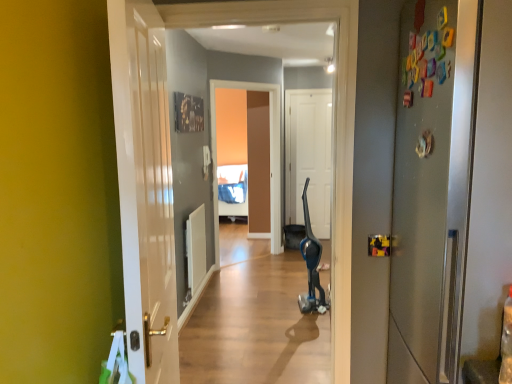
Question: In terms of width, does white glossy door at left, the 2th door viewed from the front, look wider or thinner when compared to satin silver refrigerator at right, positioned as the third door in left-to-right order?

Choices:
 (A) thin
 (B) wide

Answer: (A)

Question: From the image's perspective, is white glossy door at left, the 2th door viewed from the front, positioned above or below satin silver refrigerator at right, which is counted as the 3th door, starting from the back?

Choices:
 (A) above
 (B) below

Answer: (B)

Question: Which object is positioned farthest from the white glossy door at left, positioned as the 3th door in right-to-left order?

Choices:
 (A) matte brown screen door at center
 (B) blue metallic vacuum cleaner at center
 (C) black plastic vacuum cleaner at center
 (D) satin silver refrigerator at right, which is counted as the 3th door, starting from the back
 (E) white matte door at center, positioned as the 3th door in front-to-back order

Answer: (E)

Question: Which object is positioned closest to the black plastic vacuum cleaner at center?

Choices:
 (A) matte brown screen door at center
 (B) white matte door at center, positioned as the 2th door in right-to-left order
 (C) blue metallic vacuum cleaner at center
 (D) white glossy door at left, the first door positioned from the left
 (E) satin silver refrigerator at right, which is counted as the 3th door, starting from the back

Answer: (C)